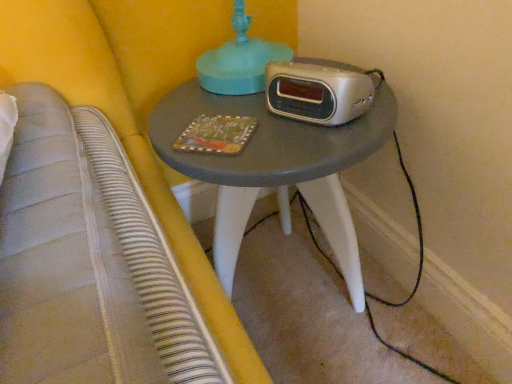
Image resolution: width=512 pixels, height=384 pixels. I want to click on empty space that is ontop of matte gray table at center (from a real-world perspective), so click(x=250, y=116).